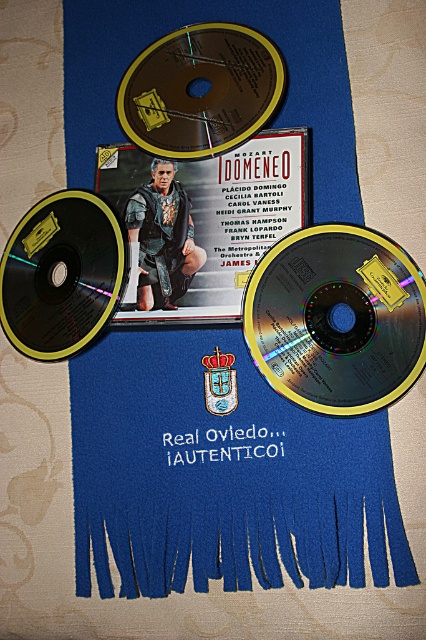
You are organizing a music collection and see the matte black album cover at center and the gold compact disc at center. Which item is positioned lower on the surface?

The matte black album cover at center is positioned lower than the gold compact disc at center.

You are organizing a music collection and see the matte black album cover at center and the gold compact disc at center. Which one is taller?

The matte black album cover at center is taller than the gold compact disc at center.